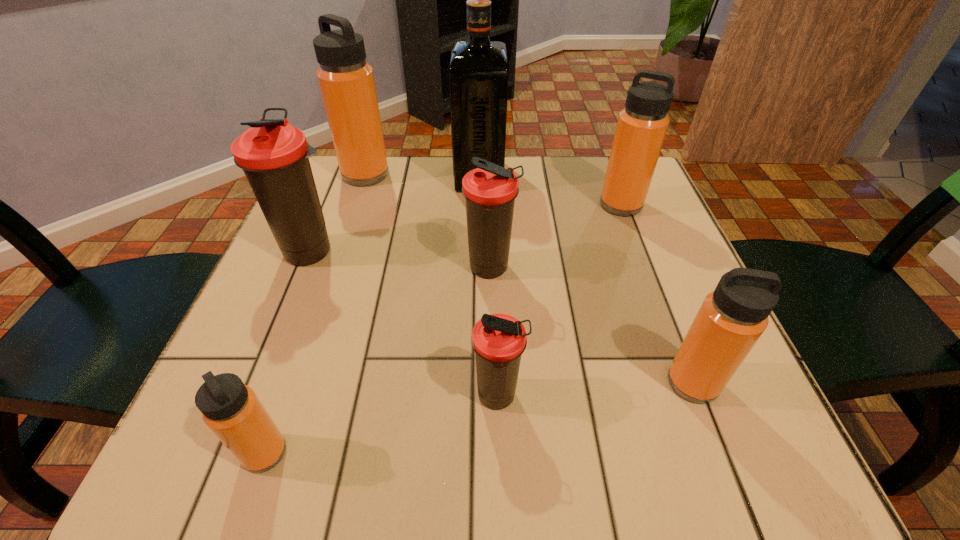
Identify the location of the nearest thermos bottle. (232, 410).

This screenshot has width=960, height=540. Identify the location of free space located 0.240m on the front label of the liquor. (597, 176).

This screenshot has width=960, height=540. Identify the location of free location located on the front of the biggest orange thermos bottle. (348, 229).

Identify the location of free space located on the front of the biggest brown thermos bottle. The height and width of the screenshot is (540, 960). (294, 295).

The image size is (960, 540). What are the coordinates of `vacant space located 0.200m on the left of the third smallest orange thermos bottle` in the screenshot? It's located at (514, 205).

Locate an element on the screen. Image resolution: width=960 pixels, height=540 pixels. free space located on the left of the second biggest brown thermos bottle is located at coordinates (282, 269).

Locate an element on the screen. The height and width of the screenshot is (540, 960). vacant space located 0.400m on the back of the third farthest orange thermos bottle is located at coordinates (627, 213).

Locate an element on the screen. The image size is (960, 540). vacant space located 0.180m on the left of the nearest brown thermos bottle is located at coordinates (354, 397).

Where is `vacant space situated 0.050m on the back of the nearest thermos bottle`? The width and height of the screenshot is (960, 540). vacant space situated 0.050m on the back of the nearest thermos bottle is located at coordinates (283, 401).

Find the location of a particular element. This screenshot has width=960, height=540. liquor positioned at the far edge is located at coordinates (478, 76).